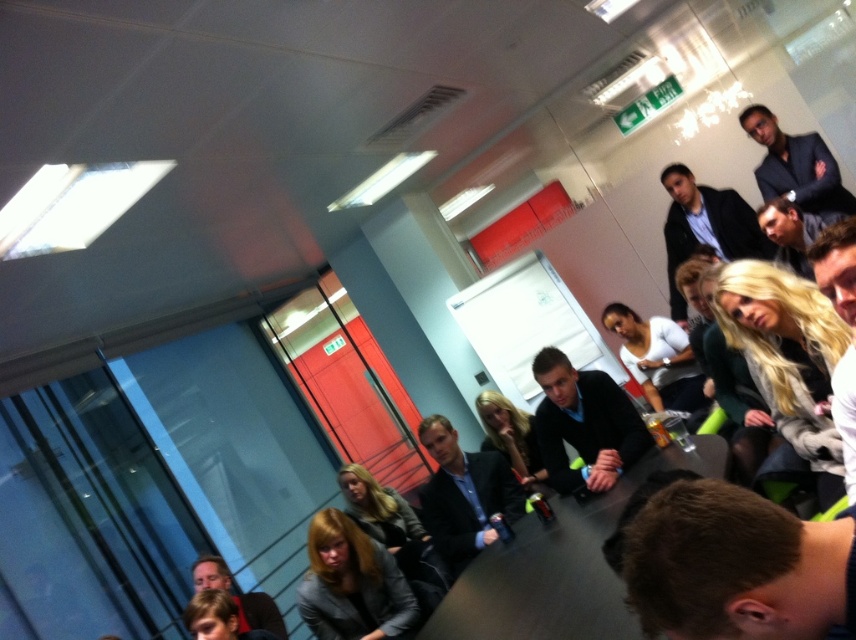
In the scene described, there is a point marked at coordinates (736, 566). Based on the objects present, what does this point most likely represent?

The point at coordinates (736, 566) most likely represents the location of the brown hair at lower right.

You are a professional photographer setting up for a group photo. You need to position a camera on a tripod between the black glossy table at center and the matte black suit at center. The tripod requires at least 18 inches of space to set up. Can you fit the tripod between them?

The black glossy table at center and matte black suit at center are 22.44 inches apart from each other. Since the tripod requires at least 18 inches of space, the 22.44 inches between them is sufficient, so yes, the tripod can be placed between them.

You are a photographer positioned at the entrance of the room. You need to capture a photo where both the brown hair at lower right and the dark blue suit at upper right are clearly visible. Given their sizes, which object should you focus on first to ensure both are in focus?

The brown hair at lower right is smaller than the dark blue suit at upper right. To ensure both are in focus, you should focus on the brown hair at lower right first because smaller objects require closer attention to maintain sharpness, allowing the larger dark blue suit at upper right to remain in focus as well.